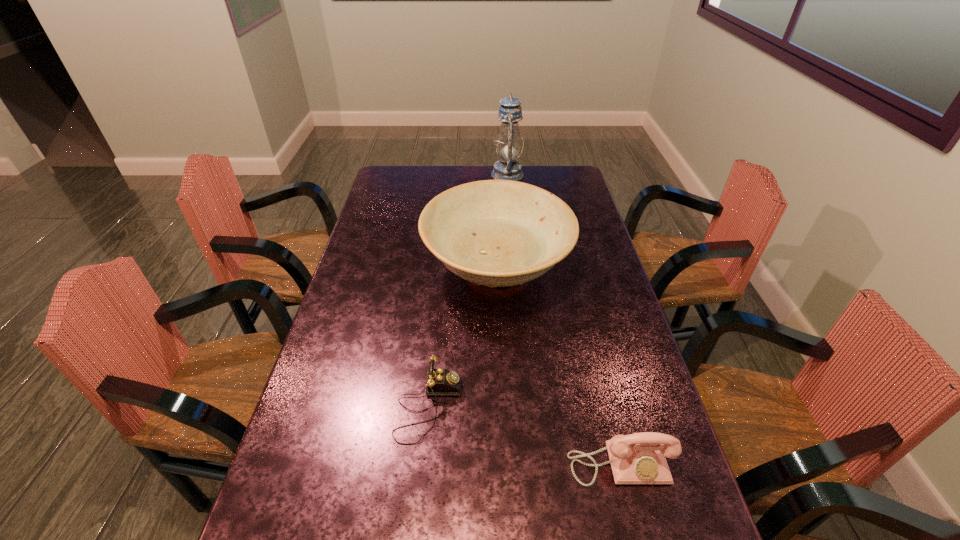
Where is `free region that satisfies the following two spatial constraints: 1. on the front-facing side of the tallest object; 2. on the front side of the third nearest object`? The width and height of the screenshot is (960, 540). free region that satisfies the following two spatial constraints: 1. on the front-facing side of the tallest object; 2. on the front side of the third nearest object is located at coordinates (516, 270).